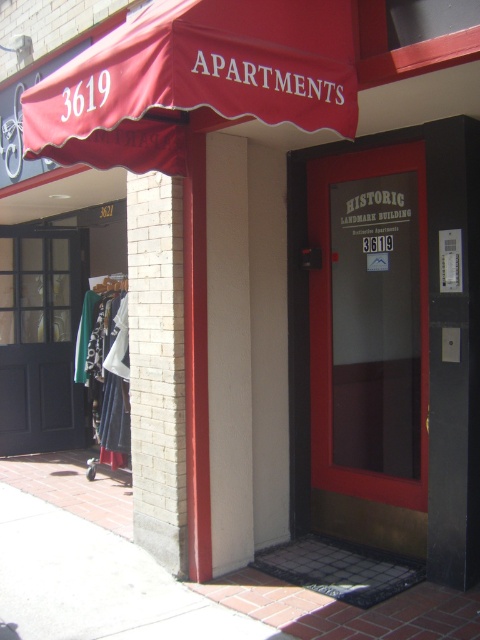
Is matte red awning at upper center bigger than matte black door at left?

Correct, matte red awning at upper center is larger in size than matte black door at left.

What do you see at coordinates (194, 81) in the screenshot?
I see `matte red awning at upper center` at bounding box center [194, 81].

In order to click on matte red awning at upper center in this screenshot , I will do `click(194, 81)`.

Is matte glass door at center thinner than matte black door at left?

Yes.

Who is positioned more to the left, matte glass door at center or matte black door at left?

matte black door at left

What do you see at coordinates (371, 349) in the screenshot? The width and height of the screenshot is (480, 640). I see `matte glass door at center` at bounding box center [371, 349].

This screenshot has height=640, width=480. Identify the location of matte glass door at center. (371, 349).

Is matte glass door at center positioned at the back of matte red awning at upper center?

Yes, matte glass door at center is further from the viewer.

Can you confirm if matte glass door at center is wider than matte red awning at upper center?

No, matte glass door at center is not wider than matte red awning at upper center.

You are a GUI agent. You are given a task and a screenshot of the screen. Output one action in this format:
    pyautogui.click(x=<x>, y=<y>)
    Task: Click on the matte glass door at center
    The image size is (480, 640).
    Given the screenshot: What is the action you would take?
    pyautogui.click(x=371, y=349)